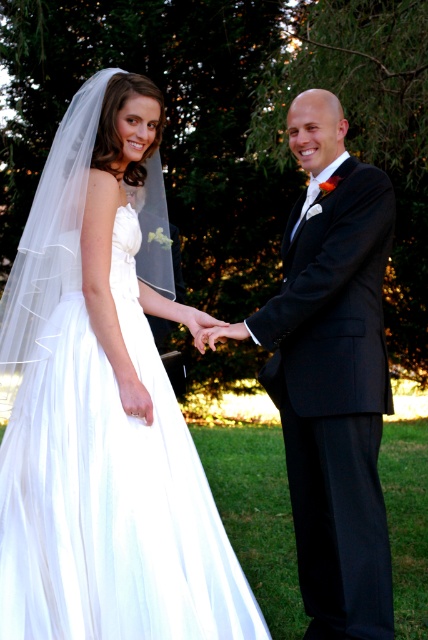
Find the location of a particular element. Image resolution: width=428 pixels, height=640 pixels. white tulle dress at left is located at coordinates (104, 403).

Who is more forward, (110, 570) or (332, 552)?

Positioned in front is point (110, 570).

At what (x,y) coordinates should I click in order to perform the action: click on white tulle dress at left. Please return your answer as a coordinate pair (x, y). Looking at the image, I should click on point(104,403).